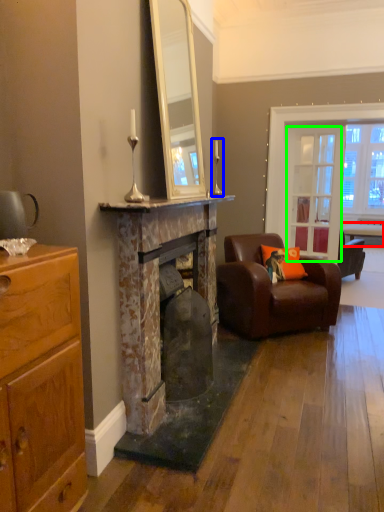
Question: Which object is the farthest from table (highlighted by a red box)? Choose among these: table lamp (highlighted by a blue box) or glass door (highlighted by a green box).

Choices:
 (A) table lamp
 (B) glass door

Answer: (A)